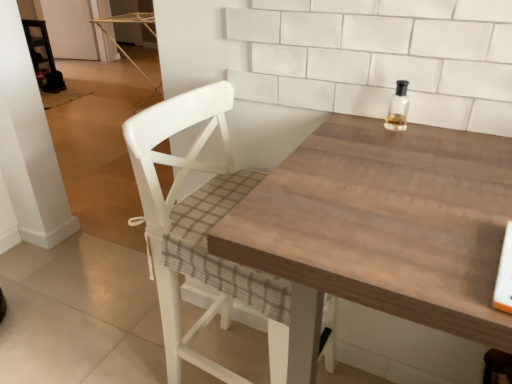
Question: From a real-world perspective, is wooden table at center physically located above or below clear glass bottle at upper right?

Choices:
 (A) below
 (B) above

Answer: (A)

Question: Relative to clear glass bottle at upper right, is wooden table at center in front or behind?

Choices:
 (A) front
 (B) behind

Answer: (A)

Question: Which is nearer to the white wood chair at center?

Choices:
 (A) clear glass bottle at upper right
 (B) wooden table at center

Answer: (B)

Question: Which object is the farthest from the clear glass bottle at upper right?

Choices:
 (A) wooden table at center
 (B) white wood chair at center

Answer: (B)